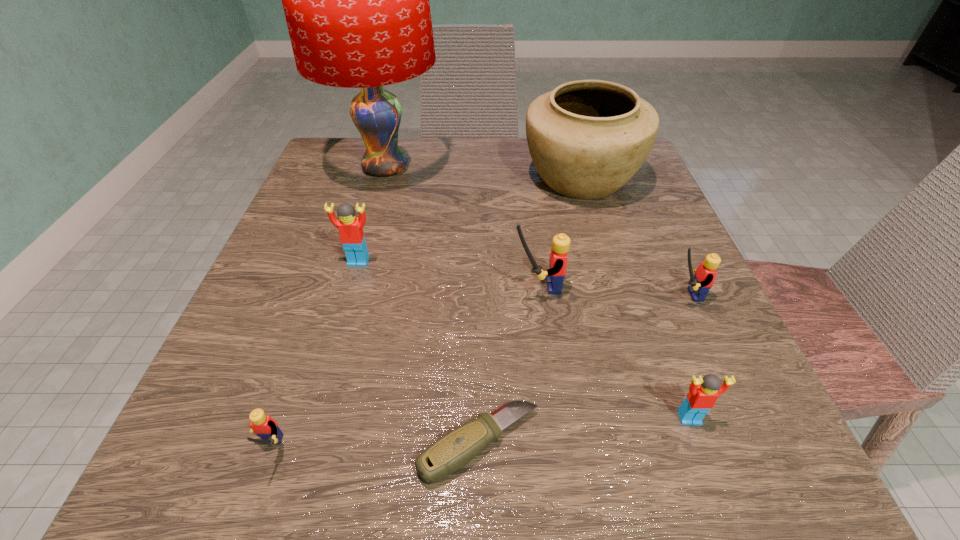
At what (x,y) coordinates should I click in order to perform the action: click on lampshade. Please return your answer as a coordinate pair (x, y). The image size is (960, 540). Looking at the image, I should click on (356, 0).

Identify the location of pottery. (587, 138).

Find the location of a particular element. The width and height of the screenshot is (960, 540). the second yellow Lego from right to left is located at coordinates (558, 258).

Locate an element on the screen. The width and height of the screenshot is (960, 540). the tallest Lego is located at coordinates (558, 258).

At what (x,y) coordinates should I click in order to perform the action: click on the farthest Lego. Please return your answer as a coordinate pair (x, y). This screenshot has width=960, height=540. Looking at the image, I should click on (350, 227).

You are a GUI agent. You are given a task and a screenshot of the screen. Output one action in this format:
    pyautogui.click(x=<x>, y=<y>)
    Task: Click on the bigger red Lego
    
    Given the screenshot: What is the action you would take?
    pyautogui.click(x=350, y=227)

Find the location of `the rightmost yellow Lego`. the rightmost yellow Lego is located at coordinates (699, 284).

I want to click on the rightmost Lego, so click(699, 284).

At what (x,y) coordinates should I click in order to perform the action: click on the smaller red Lego. Please return your answer as a coordinate pair (x, y). Looking at the image, I should click on pyautogui.click(x=703, y=393).

In order to click on the right red Lego in this screenshot , I will do `click(703, 393)`.